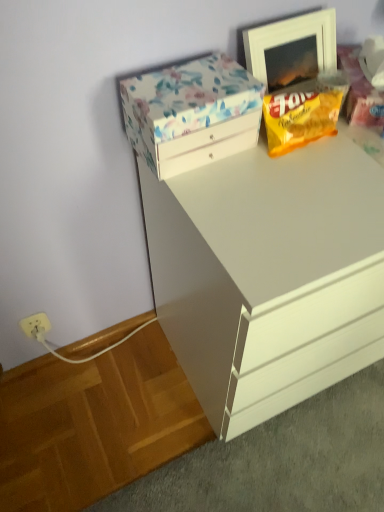
Locate an element on the screen. vacant space in front of floral-patterned cardboard box at upper left is located at coordinates (229, 199).